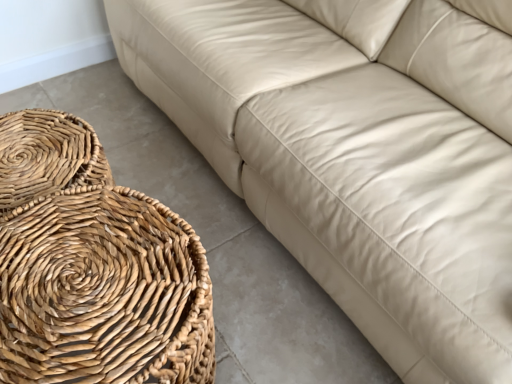
Where is `natural woven wood round table at lower left`? The image size is (512, 384). natural woven wood round table at lower left is located at coordinates (93, 267).

Describe the element at coordinates (93, 267) in the screenshot. This screenshot has width=512, height=384. I see `natural woven wood round table at lower left` at that location.

What is the approximate width of natural woven wood round table at lower left?

natural woven wood round table at lower left is 45.76 centimeters in width.

Where is `natural woven wood round table at lower left`? The width and height of the screenshot is (512, 384). natural woven wood round table at lower left is located at coordinates (93, 267).